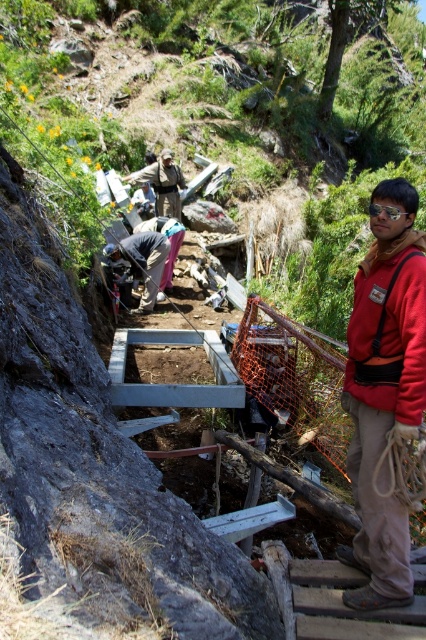
Question: Which object is positioned farthest from the khaki pants at center?

Choices:
 (A) khaki uniform at center
 (B) dark gray fabric at center

Answer: (A)

Question: Which point is farther to the camera?

Choices:
 (A) (126, 176)
 (B) (406, 595)
 (C) (374, 269)

Answer: (A)

Question: Does khaki pants at center lie in front of red matte jacket at right?

Choices:
 (A) yes
 (B) no

Answer: (B)

Question: Which object appears farthest from the camera in this image?

Choices:
 (A) dark gray fabric at center
 (B) khaki uniform at center
 (C) red matte jacket at right
 (D) khaki pants at center

Answer: (B)

Question: Does khaki pants at center have a lesser width compared to khaki uniform at center?

Choices:
 (A) no
 (B) yes

Answer: (B)

Question: Can you confirm if khaki pants at center is positioned to the right of red matte jacket at right?

Choices:
 (A) no
 (B) yes

Answer: (B)